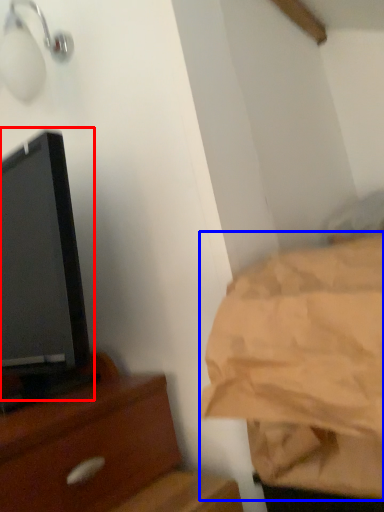
Question: Which point is further to the camera, tv show (highlighted by a red box) or sheet (highlighted by a blue box)?

Choices:
 (A) tv show
 (B) sheet

Answer: (A)